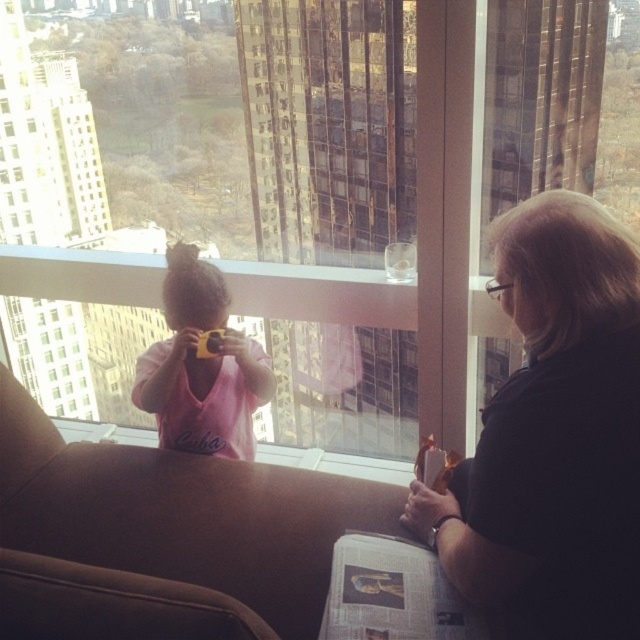
Question: Estimate the real-world distances between objects in this image. Which object is closer to the pink matte shirt at center?

Choices:
 (A) black matte shirt at right
 (B) transparent glass window at center

Answer: (B)

Question: Which point is farther to the camera?

Choices:
 (A) black matte shirt at right
 (B) pink matte shirt at center
 (C) transparent glass window at center

Answer: (B)

Question: Can you confirm if transparent glass window at center is thinner than black matte shirt at right?

Choices:
 (A) no
 (B) yes

Answer: (A)

Question: Is transparent glass window at center to the right of pink matte shirt at center from the viewer's perspective?

Choices:
 (A) yes
 (B) no

Answer: (A)

Question: Considering the real-world distances, which object is closest to the transparent glass window at center?

Choices:
 (A) pink matte shirt at center
 (B) black matte shirt at right

Answer: (A)

Question: Is black matte shirt at right thinner than pink matte shirt at center?

Choices:
 (A) yes
 (B) no

Answer: (A)